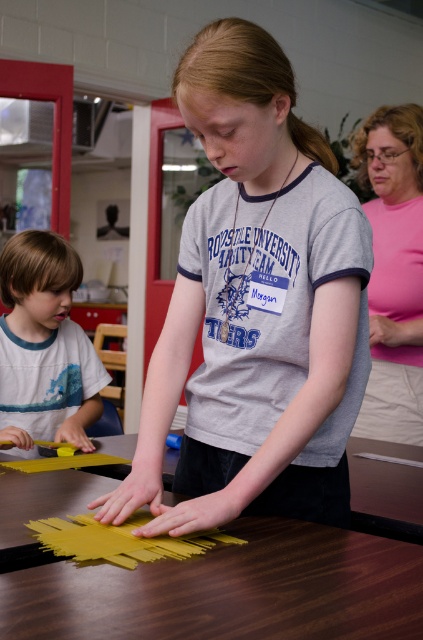
Does point (340, 259) come in front of point (390, 228)?

That is True.

Is gray matte shirt at center below pink fabric at upper right?

Correct, gray matte shirt at center is located below pink fabric at upper right.

Which is behind, point (192, 474) or point (408, 113)?

Positioned behind is point (408, 113).

You are a GUI agent. You are given a task and a screenshot of the screen. Output one action in this format:
    pyautogui.click(x=<x>, y=<y>)
    Task: Click on the gray matte shirt at center
    
    Given the screenshot: What is the action you would take?
    click(x=255, y=307)

What do you see at coordinates (393, 273) in the screenshot? Image resolution: width=423 pixels, height=640 pixels. I see `pink fabric at upper right` at bounding box center [393, 273].

Is point (414, 346) behind point (5, 262)?

Yes, it is.

Identify the location of pink fabric at upper right. The width and height of the screenshot is (423, 640). (393, 273).

Can you confirm if gray matte shirt at center is thinner than wooden table at center?

Indeed, gray matte shirt at center has a lesser width compared to wooden table at center.

Between gray matte shirt at center and wooden table at center, which one appears on the right side from the viewer's perspective?

gray matte shirt at center is more to the right.

Is point (208, 92) positioned in front of point (371, 616)?

That is False.

Identify the location of gray matte shirt at center. This screenshot has height=640, width=423. (255, 307).